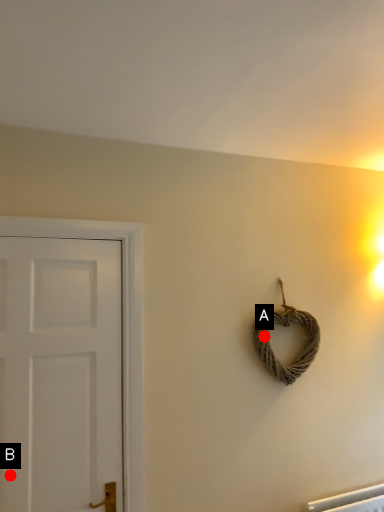
Question: Two points are circled on the image, labeled by A and B beside each circle. Which point appears closest to the camera in this image?

Choices:
 (A) A is closer
 (B) B is closer

Answer: (B)